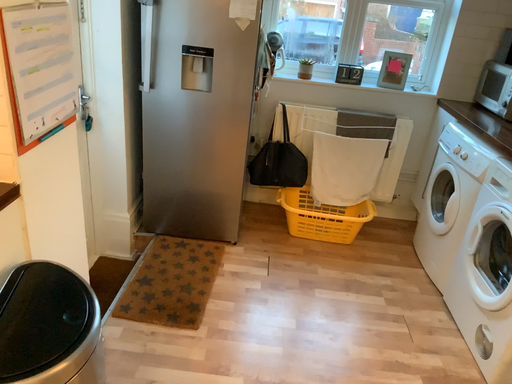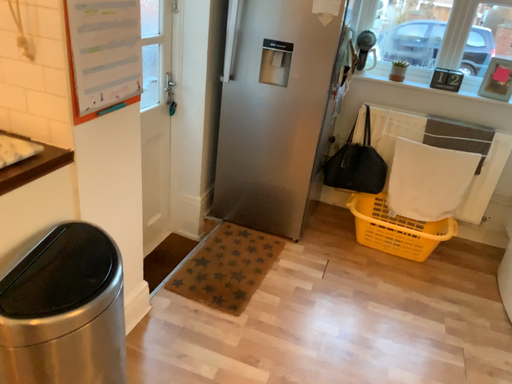
Question: How did the camera likely rotate when shooting the video?

Choices:
 (A) rotated left
 (B) rotated right

Answer: (A)